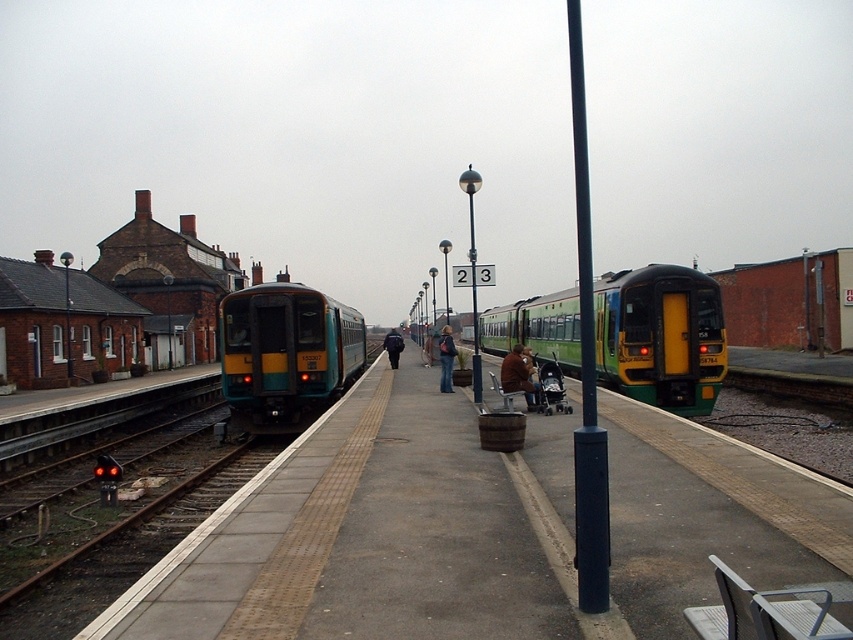
You are standing on the platform and see two people wearing jackets. One is wearing a brown leather jacket at center and the other a dark blue jacket at center. Which jacket is closer to you?

The brown leather jacket at center is closer to you because it is in front of the dark blue jacket at center.